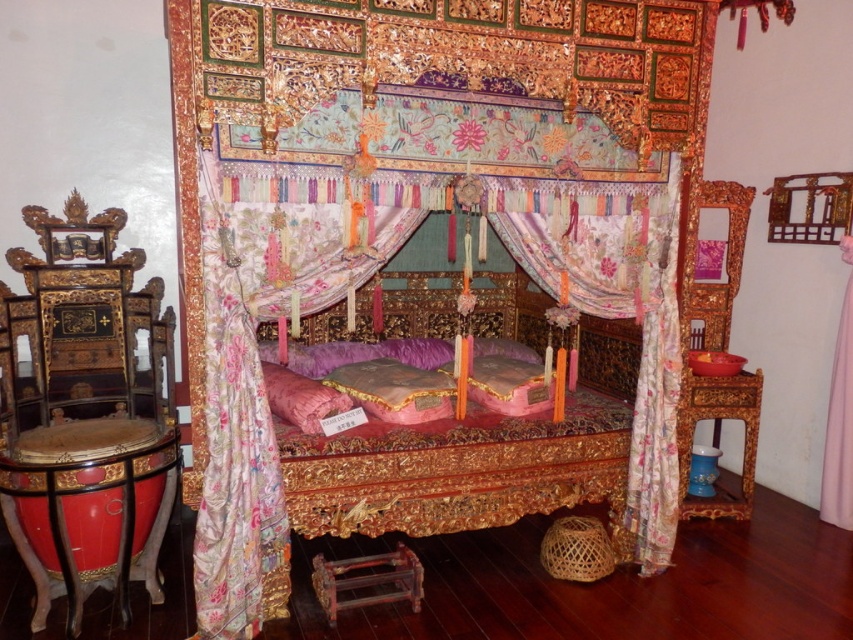
Question: Can you confirm if glossy wood chair at left is positioned above silky floral curtain at center?

Choices:
 (A) yes
 (B) no

Answer: (B)

Question: Does gold-carved canopy bed at center come behind pink satin curtain at right?

Choices:
 (A) yes
 (B) no

Answer: (B)

Question: Considering the real-world distances, which object is closest to the gold-carved canopy bed at center?

Choices:
 (A) glossy wood chair at left
 (B) silky floral curtain at center

Answer: (B)

Question: Can you confirm if gold-carved canopy bed at center is positioned to the left of carved wood side table at lower right?

Choices:
 (A) yes
 (B) no

Answer: (A)

Question: Among these points, which one is nearest to the camera?

Choices:
 (A) (659, 461)
 (B) (752, 490)
 (C) (187, 209)
 (D) (228, 634)

Answer: (C)

Question: Which point is closer to the camera?

Choices:
 (A) floral silk curtain at right
 (B) pink satin curtain at right
 (C) gold-carved canopy bed at center

Answer: (C)